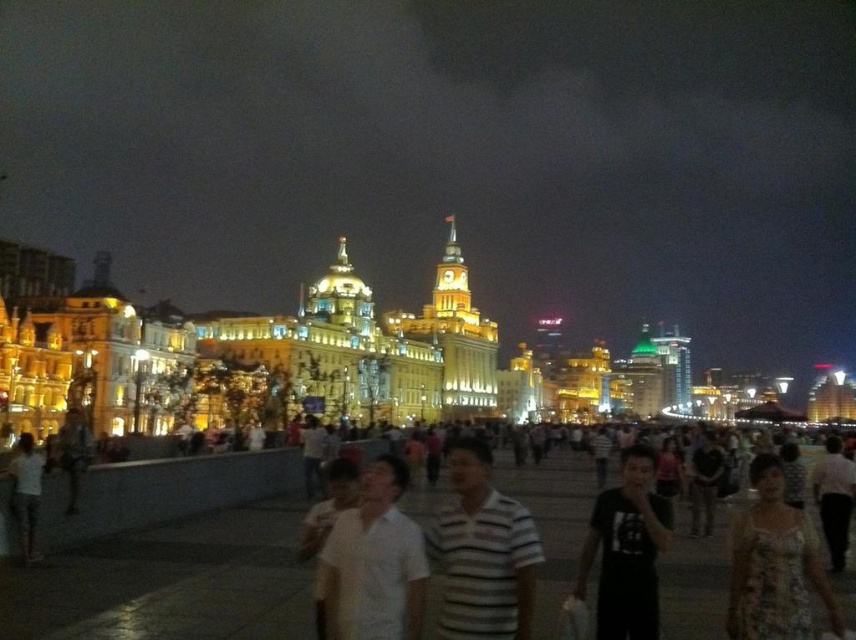
Measure the distance between striped cotton shirt at center and black matte shirt at center.

The distance of striped cotton shirt at center from black matte shirt at center is 24.27 feet.

Identify the location of striped cotton shirt at center. pos(482,552).

You are a GUI agent. You are given a task and a screenshot of the screen. Output one action in this format:
    pyautogui.click(x=<x>, y=<y>)
    Task: Click on the striped cotton shirt at center
    
    Given the screenshot: What is the action you would take?
    pyautogui.click(x=482, y=552)

Between floral dress at lower right and black matte shirt at center, which one is positioned lower?

Positioned lower is black matte shirt at center.

Consider the image. Can you confirm if floral dress at lower right is wider than black matte shirt at center?

Correct, the width of floral dress at lower right exceeds that of black matte shirt at center.

Is point (771, 531) positioned behind point (608, 564)?

No, it is in front of (608, 564).

Where is `floral dress at lower right`? floral dress at lower right is located at coordinates (774, 564).

Between white matte shirt at center and black matte shirt at center, which one has more height?

With more height is black matte shirt at center.

The height and width of the screenshot is (640, 856). Describe the element at coordinates (373, 563) in the screenshot. I see `white matte shirt at center` at that location.

Is point (383, 524) closer to camera compared to point (651, 545)?

That is True.

Find the location of `white matte shirt at center`. white matte shirt at center is located at coordinates (373, 563).